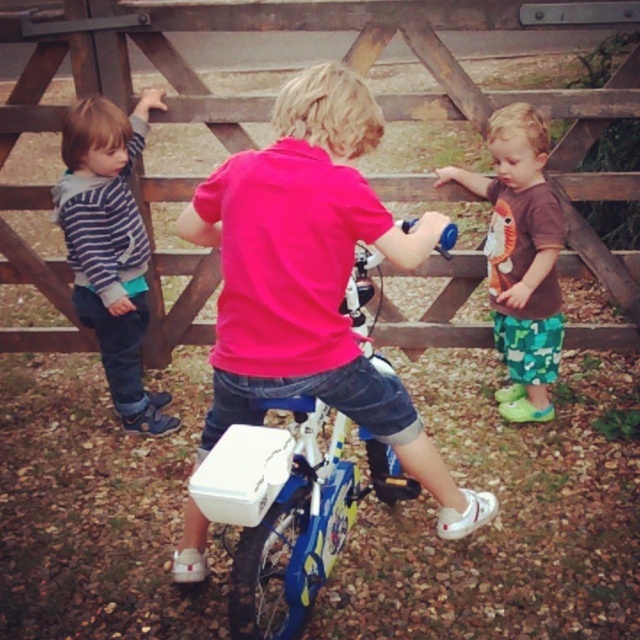
Can you confirm if pink matte shirt at center is positioned to the right of striped hoodie at left?

Yes, pink matte shirt at center is to the right of striped hoodie at left.

Can you confirm if pink matte shirt at center is positioned above striped hoodie at left?

Actually, pink matte shirt at center is below striped hoodie at left.

Which is behind, point (205, 241) or point (84, 256)?

Point (84, 256)

In order to click on pink matte shirt at center in this screenshot , I will do `click(312, 278)`.

The width and height of the screenshot is (640, 640). What are the coordinates of `striped hoodie at left` in the screenshot? It's located at (109, 248).

Does striped hoodie at left appear under brown cotton shirt at right?

Incorrect, striped hoodie at left is not positioned below brown cotton shirt at right.

At what (x,y) coordinates should I click in order to perform the action: click on striped hoodie at left. Please return your answer as a coordinate pair (x, y). This screenshot has width=640, height=640. Looking at the image, I should click on (109, 248).

What do you see at coordinates (356, 68) in the screenshot? The width and height of the screenshot is (640, 640). I see `wooden fence at center` at bounding box center [356, 68].

Is wooden fence at center below striped hoodie at left?

Incorrect, wooden fence at center is not positioned below striped hoodie at left.

Is point (241, 115) positioned behind point (124, 188)?

Yes, point (241, 115) is behind point (124, 188).

I want to click on wooden fence at center, so click(x=356, y=68).